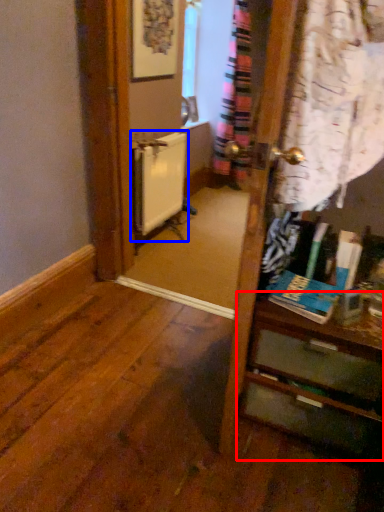
Question: Which object appears closest to the camera in this image, vanity (highlighted by a red box) or radiator (highlighted by a blue box)?

Choices:
 (A) vanity
 (B) radiator

Answer: (A)